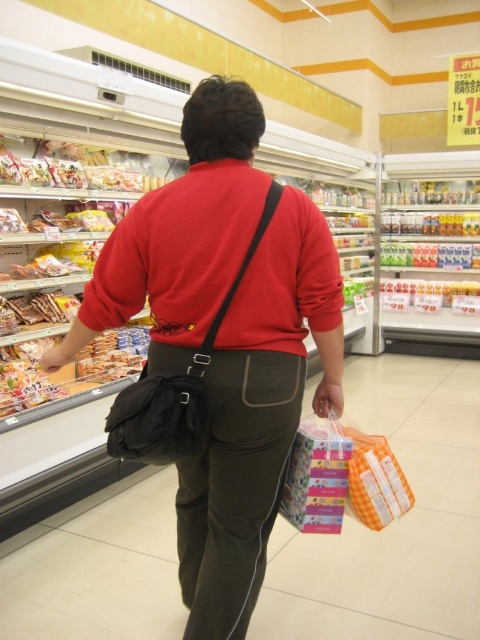
Question: Does matte black bag at center have a greater width compared to black fabric bag at back?

Choices:
 (A) no
 (B) yes

Answer: (B)

Question: Which of the following is the closest to the observer?

Choices:
 (A) (236, 456)
 (B) (191, 364)

Answer: (B)

Question: Among these objects, which one is farthest from the camera?

Choices:
 (A) black fabric bag at back
 (B) matte black bag at center

Answer: (B)

Question: Is matte black bag at center positioned at the back of black fabric bag at back?

Choices:
 (A) yes
 (B) no

Answer: (A)

Question: Does matte black bag at center have a smaller size compared to black fabric bag at back?

Choices:
 (A) yes
 (B) no

Answer: (B)

Question: Which of the following is the farthest from the observer?

Choices:
 (A) black fabric bag at back
 (B) matte black bag at center

Answer: (B)